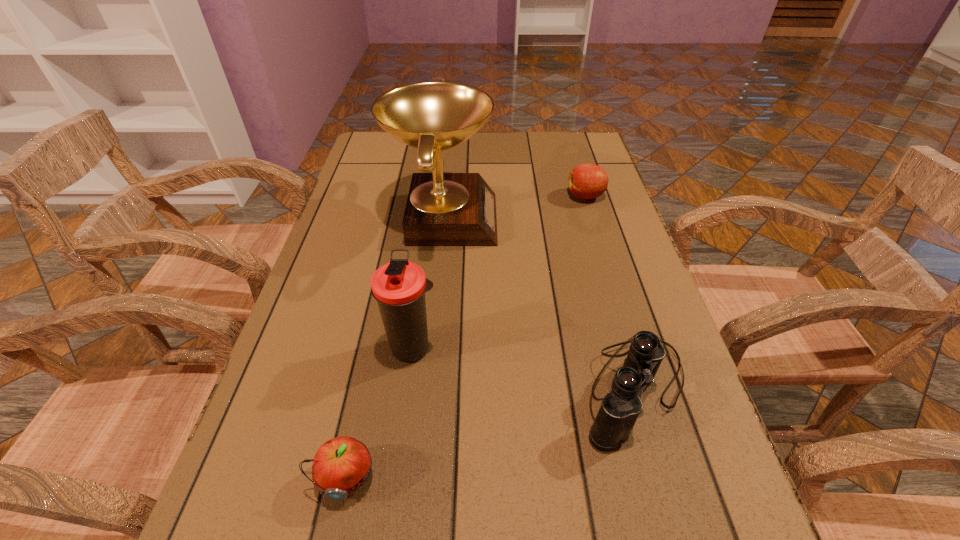
Locate an element on the screen. This screenshot has height=540, width=960. free area in between the right apple and the binoculars is located at coordinates (610, 292).

Find the location of a particular element. The height and width of the screenshot is (540, 960). free space that is in between the third shortest object and the left apple is located at coordinates (489, 433).

Locate an element on the screen. This screenshot has width=960, height=540. free spot between the thermos bottle and the nearer apple is located at coordinates (379, 413).

The height and width of the screenshot is (540, 960). Identify the location of free point between the farther apple and the nearer apple. pyautogui.click(x=466, y=337).

This screenshot has height=540, width=960. What are the coordinates of `free space between the farther apple and the nearer apple` in the screenshot? It's located at (466, 337).

Identify the location of empty space between the left apple and the thermos bottle. (x=379, y=413).

Locate an element on the screen. The image size is (960, 540). vacant space that's between the binoculars and the right apple is located at coordinates (x=610, y=292).

You are a GUI agent. You are given a task and a screenshot of the screen. Output one action in this format:
    pyautogui.click(x=<x>, y=<y>)
    Task: Click on the empty space that is in between the right apple and the tallest object
    This screenshot has height=540, width=960.
    Given the screenshot: What is the action you would take?
    pyautogui.click(x=515, y=207)

Where is `object that is the third closest one to the farther apple`? The image size is (960, 540). object that is the third closest one to the farther apple is located at coordinates (399, 286).

Find the location of a particular element. This screenshot has height=540, width=960. object that is the closest one to the fourth shortest object is located at coordinates (341, 466).